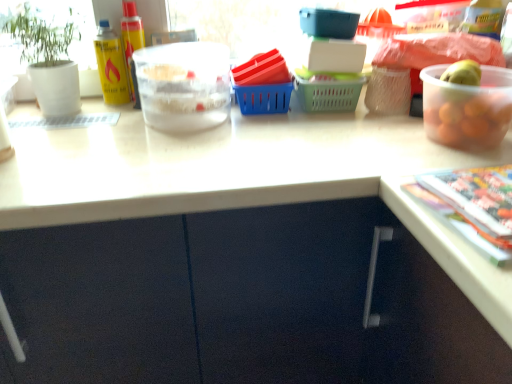
Where is `free spot below green matte plant pot at left (from a real-world perspective)`? Image resolution: width=512 pixels, height=384 pixels. free spot below green matte plant pot at left (from a real-world perspective) is located at coordinates (58, 115).